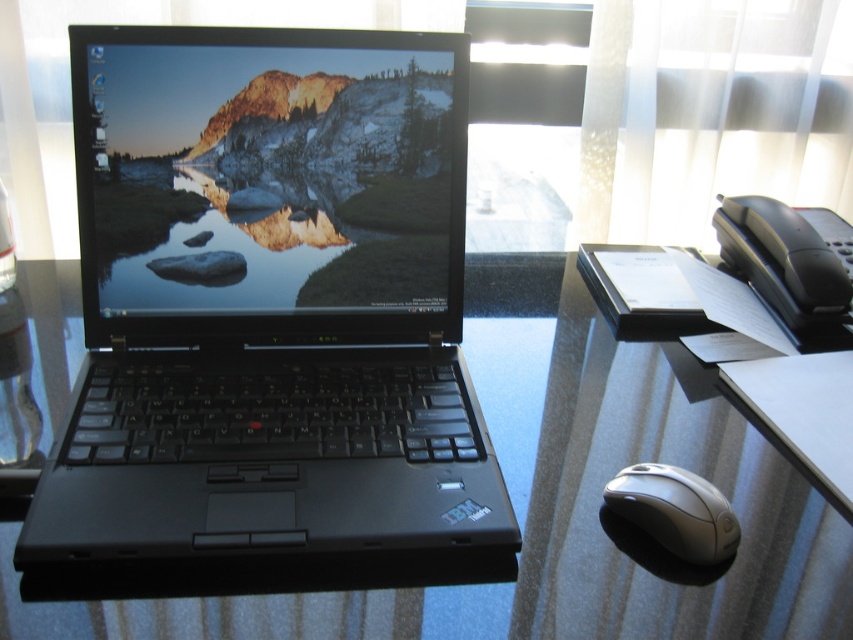
Question: Is glossy glass table at center positioned before white glossy mouse at lower right?

Choices:
 (A) no
 (B) yes

Answer: (B)

Question: Can you confirm if glossy glass table at center is bigger than white glossy mouse at lower right?

Choices:
 (A) no
 (B) yes

Answer: (B)

Question: Which point is closer to the camera?

Choices:
 (A) (606, 353)
 (B) (758, 97)
 (C) (148, 323)

Answer: (C)

Question: Which of the following is the farthest from the observer?

Choices:
 (A) white sheer curtain at upper right
 (B) glossy glass table at center

Answer: (A)

Question: Can you confirm if glossy glass table at center is positioned to the left of black plastic phone at upper right?

Choices:
 (A) yes
 (B) no

Answer: (A)

Question: Among these points, which one is farthest from the camera?

Choices:
 (A) (657, 540)
 (B) (717, 230)
 (C) (302, 435)

Answer: (B)